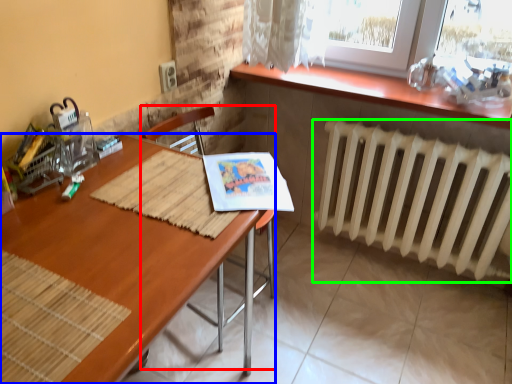
Question: Considering the real-world distances, which object is farthest from armchair (highlighted by a red box)? desk (highlighted by a blue box) or radiator (highlighted by a green box)?

Choices:
 (A) desk
 (B) radiator

Answer: (A)